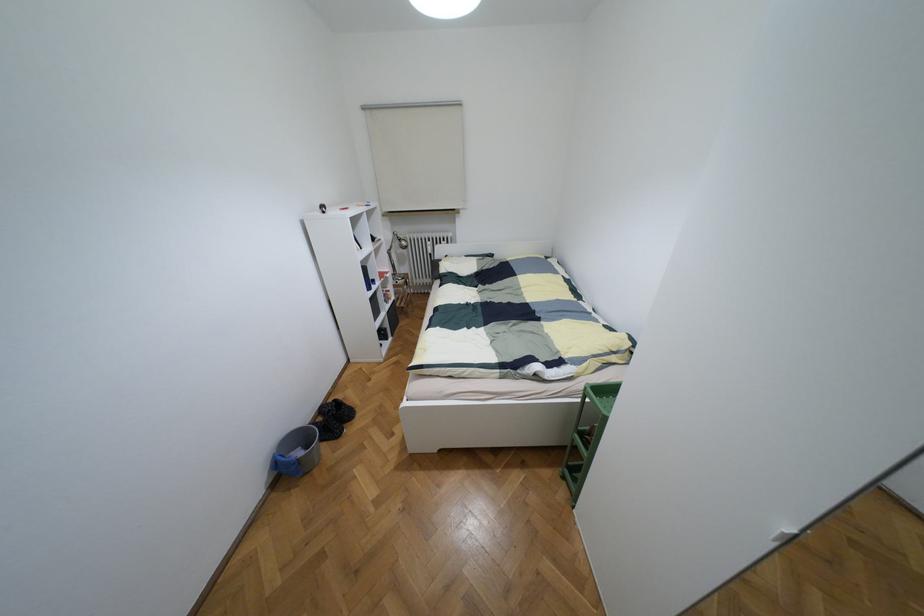
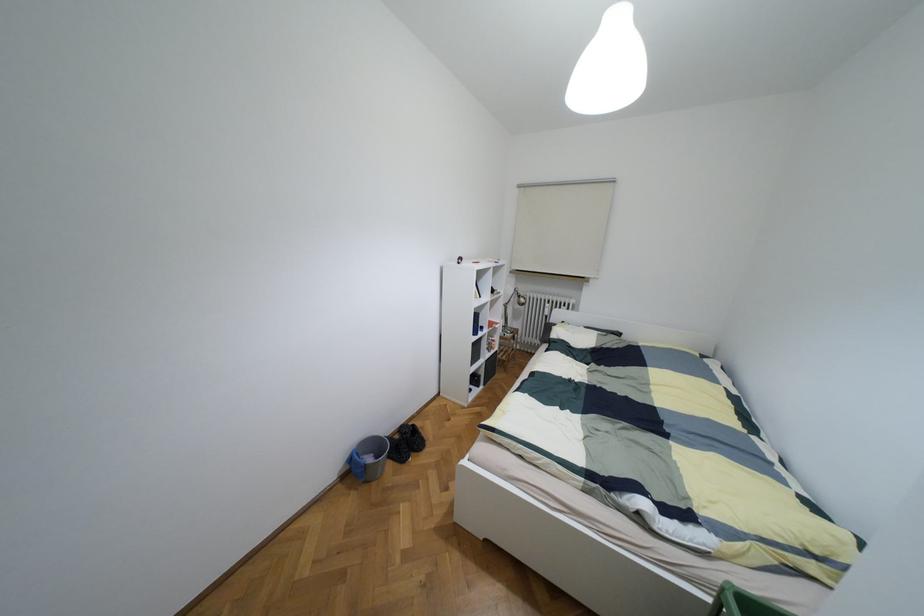
Where in the second image is the point corresponding to (x=334, y=400) from the first image?

(412, 424)